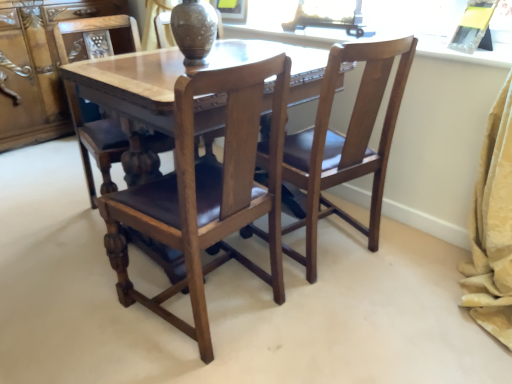
You are a GUI agent. You are given a task and a screenshot of the screen. Output one action in this format:
    pyautogui.click(x=<x>, y=<y>)
    Task: Click on the free space to the left of brown leather chair at center, which is counted as the first chair, starting from the left
    The width and height of the screenshot is (512, 384).
    Given the screenshot: What is the action you would take?
    pyautogui.click(x=50, y=215)